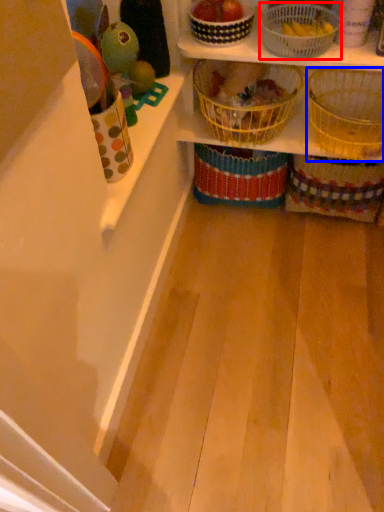
Question: Among these objects, which one is nearest to the camera, basket (highlighted by a red box) or basket (highlighted by a blue box)?

Choices:
 (A) basket
 (B) basket

Answer: (A)